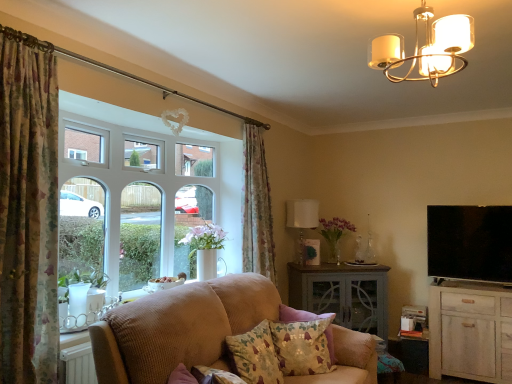
Question: From a real-world perspective, is floral fabric cushion at lower center, the first pillow positioned from the back, over white wood cabinet at lower right?

Choices:
 (A) yes
 (B) no

Answer: (A)

Question: Is floral fabric cushion at lower center, the second pillow from the front, taller than white wood cabinet at lower right?

Choices:
 (A) yes
 (B) no

Answer: (B)

Question: Considering the relative positions of floral fabric cushion at lower center, the first pillow positioned from the back, and white wood cabinet at lower right in the image provided, is floral fabric cushion at lower center, the first pillow positioned from the back, to the left of white wood cabinet at lower right from the viewer's perspective?

Choices:
 (A) yes
 (B) no

Answer: (A)

Question: Is floral fabric cushion at lower center, the first pillow positioned from the back, to the right of white wood cabinet at lower right from the viewer's perspective?

Choices:
 (A) yes
 (B) no

Answer: (B)

Question: Is the surface of floral fabric cushion at lower center, the first pillow positioned from the back, in direct contact with white wood cabinet at lower right?

Choices:
 (A) yes
 (B) no

Answer: (B)

Question: In the image, is floral fabric curtain at left, the 2th curtain viewed from the right, positioned in front of or behind white wood cabinet at lower right?

Choices:
 (A) behind
 (B) front

Answer: (B)

Question: Considering the positions of point (0, 370) and point (440, 327), is point (0, 370) closer or farther from the camera than point (440, 327)?

Choices:
 (A) farther
 (B) closer

Answer: (B)

Question: Is floral fabric curtain at left, the 2th curtain viewed from the back, situated inside white wood cabinet at lower right or outside?

Choices:
 (A) outside
 (B) inside

Answer: (A)

Question: Is floral fabric curtain at left, the 2th curtain viewed from the right, taller or shorter than white wood cabinet at lower right?

Choices:
 (A) tall
 (B) short

Answer: (A)

Question: From the image's perspective, is flat screen tv at right located above or below gray painted cabinet at center, the 1th table when ordered from left to right?

Choices:
 (A) below
 (B) above

Answer: (B)

Question: Is flat screen tv at right bigger or smaller than gray painted cabinet at center, the 1th table when ordered from left to right?

Choices:
 (A) big
 (B) small

Answer: (B)

Question: In the image, is flat screen tv at right on the left side or the right side of gray painted cabinet at center, the second table in the right-to-left sequence?

Choices:
 (A) left
 (B) right

Answer: (B)

Question: From their relative heights in the image, would you say flat screen tv at right is taller or shorter than gray painted cabinet at center, the second table in the right-to-left sequence?

Choices:
 (A) short
 (B) tall

Answer: (A)

Question: Looking at the image, does floral fabric cushion at lower center, the second pillow from the front, seem bigger or smaller compared to white glass window at left?

Choices:
 (A) big
 (B) small

Answer: (B)

Question: From their relative heights in the image, would you say floral fabric cushion at lower center, the first pillow positioned from the back, is taller or shorter than white glass window at left?

Choices:
 (A) short
 (B) tall

Answer: (A)